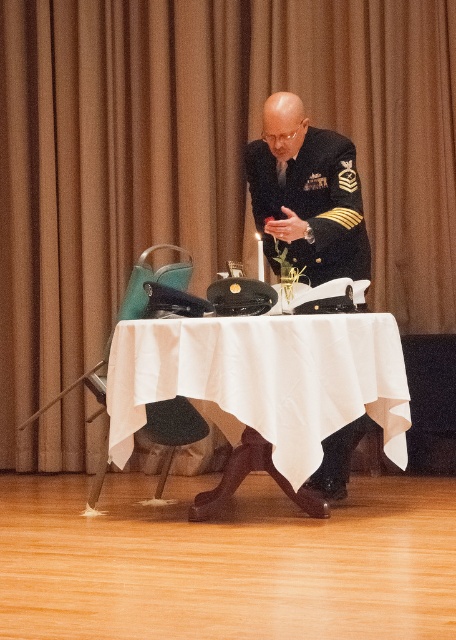
You are a stagehand setting up for a ceremony. You need to place a 1.5 meter long banner between the brown fabric curtain at upper center and the black uniform at center. Will the banner fit between them?

The distance between the brown fabric curtain at upper center and the black uniform at center is 1.49 meters. Since the banner is 1.5 meters long, it will not fit as the space is slightly shorter than the banner.

You are a guest at a formal event and need to locate the host who is wearing the black uniform at center. The room has a brown fabric curtain at upper center. Based on the scene description, is the host visible from the entrance? Explain your reasoning.

The black uniform at center is behind the brown fabric curtain at upper center, so the host wearing the black uniform at center might not be fully visible from the entrance as they are positioned behind the curtain.